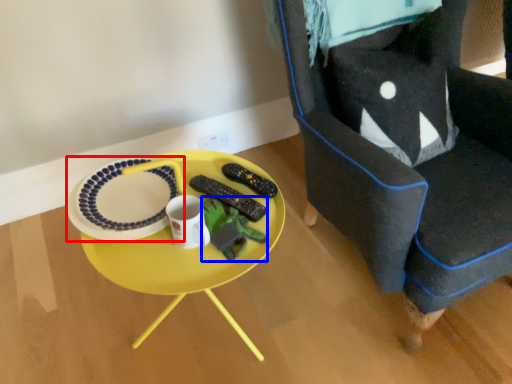
Question: Which object appears farthest to the camera in this image, platter (highlighted by a red box) or toy (highlighted by a blue box)?

Choices:
 (A) platter
 (B) toy

Answer: (A)